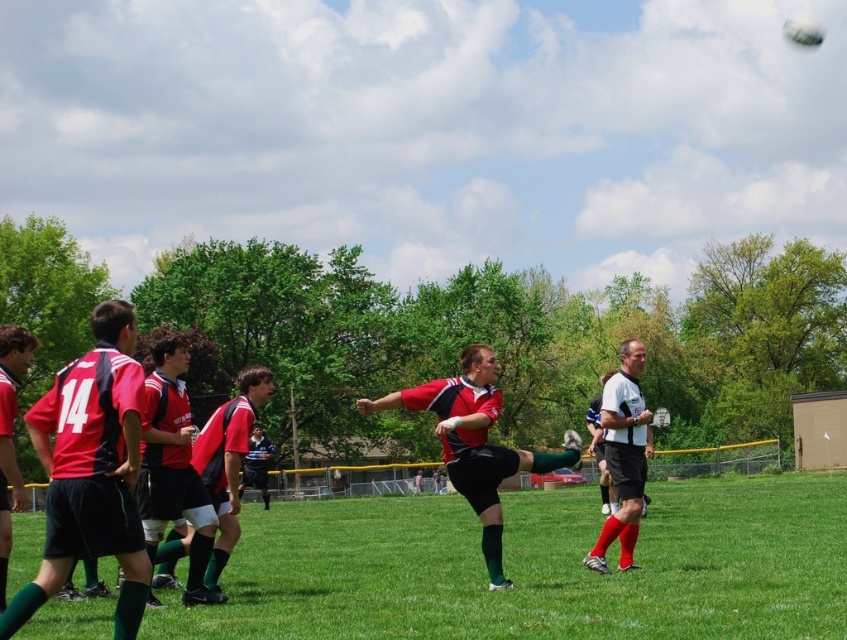
Question: Is matte red jersey at center positioned at the back of white mesh shirt at right?

Choices:
 (A) yes
 (B) no

Answer: (B)

Question: Which object is closer to the camera taking this photo?

Choices:
 (A) matte red soccer ball at center
 (B) green grass at center

Answer: (B)

Question: Which is farther from the white mesh shirt at right?

Choices:
 (A) green grass at center
 (B) matte red soccer ball at center

Answer: (A)

Question: Estimate the real-world distances between objects in this image. Which object is closer to the white mesh shirt at right?

Choices:
 (A) matte red jersey at left
 (B) matte red jersey at center
 (C) matte red soccer ball at center

Answer: (C)

Question: Is green grass at center thinner than matte red soccer ball at center?

Choices:
 (A) yes
 (B) no

Answer: (B)

Question: Can you confirm if green grass at center is smaller than matte red jersey at left?

Choices:
 (A) no
 (B) yes

Answer: (A)